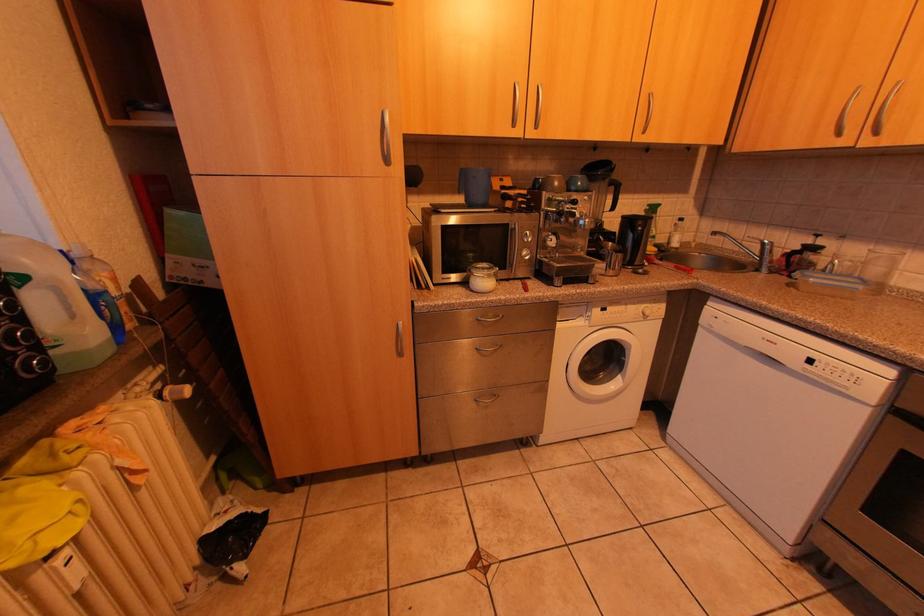
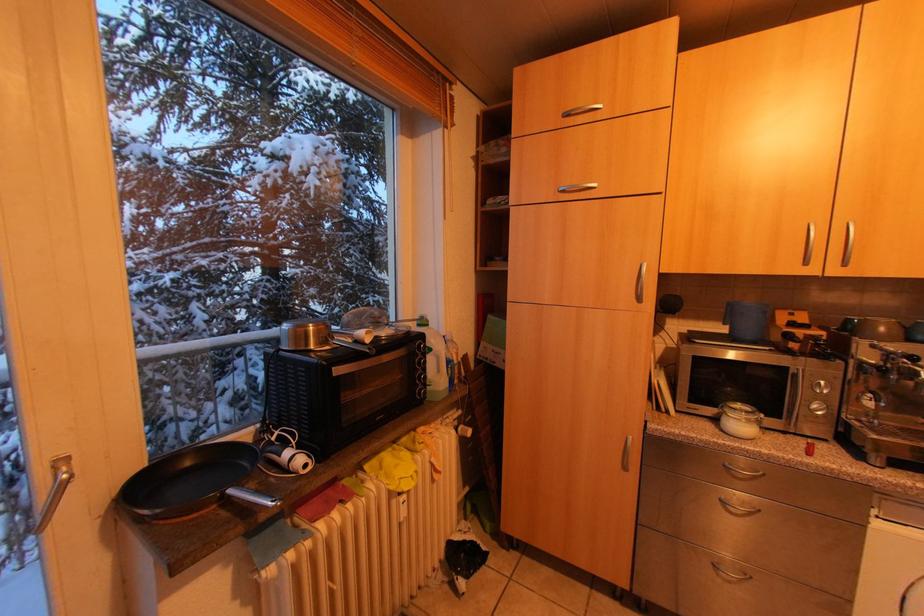
Question: The images are taken continuously from a first-person perspective. In which direction is your viewpoint rotating?

Choices:
 (A) Left
 (B) Right
 (C) Up
 (D) Down

Answer: (A)